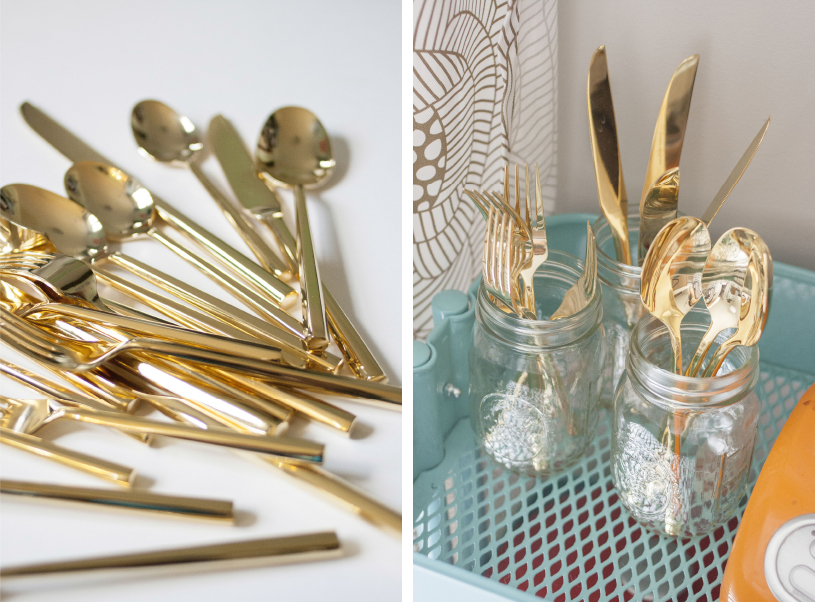
Where is `butter knife`? The height and width of the screenshot is (603, 815). butter knife is located at coordinates (600, 102), (668, 109), (742, 174), (51, 128), (239, 153).